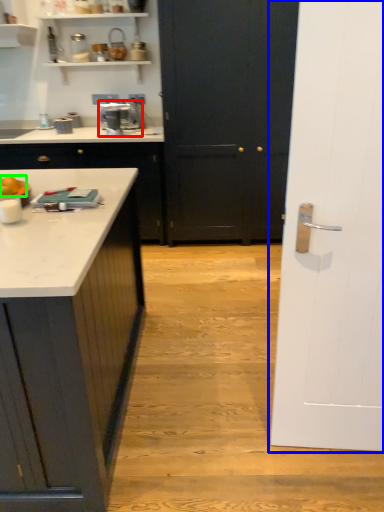
Question: Considering the real-world distances, which object is farthest from home appliance (highlighted by a red box)? door (highlighted by a blue box) or food (highlighted by a green box)?

Choices:
 (A) door
 (B) food

Answer: (A)